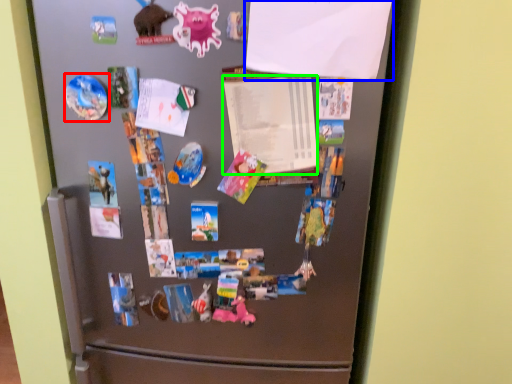
Question: Considering the real-world distances, which object is farthest from art (highlighted by a red box)? paper (highlighted by a blue box) or paper (highlighted by a green box)?

Choices:
 (A) paper
 (B) paper

Answer: (A)